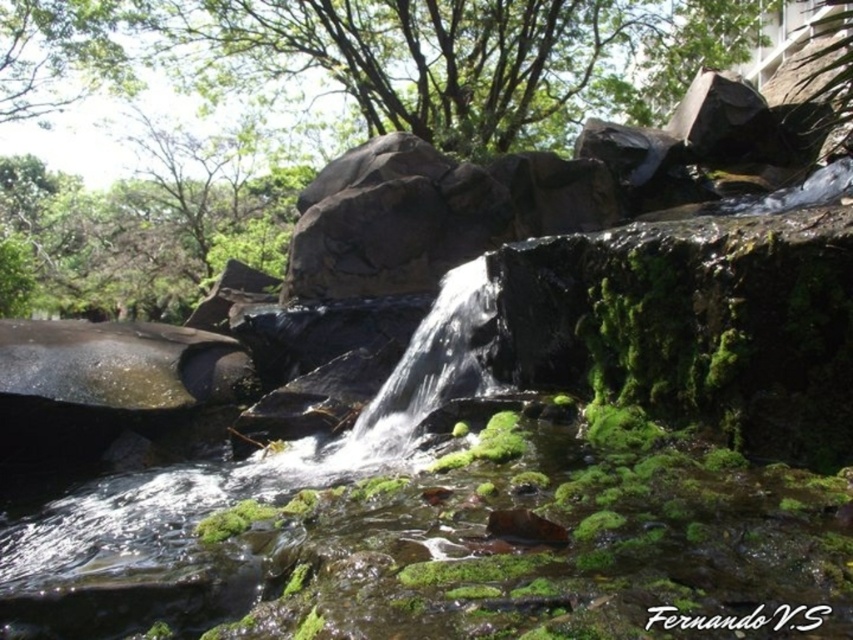
Who is positioned more to the right, green leafy tree at upper center or clear water at center?

clear water at center is more to the right.

Is green leafy tree at upper center closer to the viewer compared to clear water at center?

No, green leafy tree at upper center is behind clear water at center.

Is point (724, 8) closer to camera compared to point (473, 285)?

No.

At what (x,y) coordinates should I click in order to perform the action: click on green leafy tree at upper center. Please return your answer as a coordinate pair (x, y). Looking at the image, I should click on (387, 54).